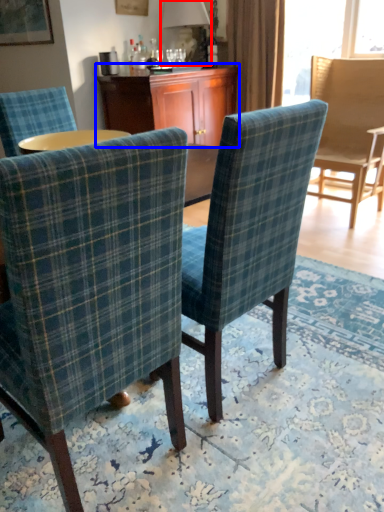
Question: Among these objects, which one is nearest to the camera, lamp (highlighted by a red box) or desk (highlighted by a blue box)?

Choices:
 (A) lamp
 (B) desk

Answer: (B)